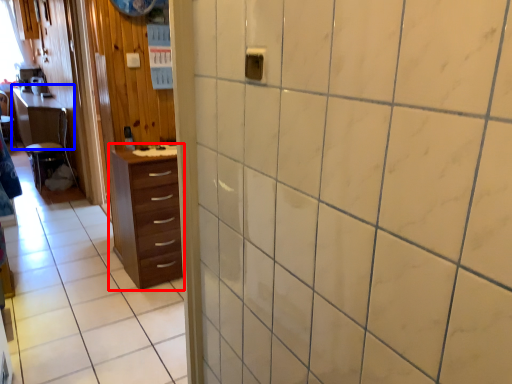
Question: Which object appears closest to the camera in this image, chest of drawers (highlighted by a red box) or table (highlighted by a blue box)?

Choices:
 (A) chest of drawers
 (B) table

Answer: (A)